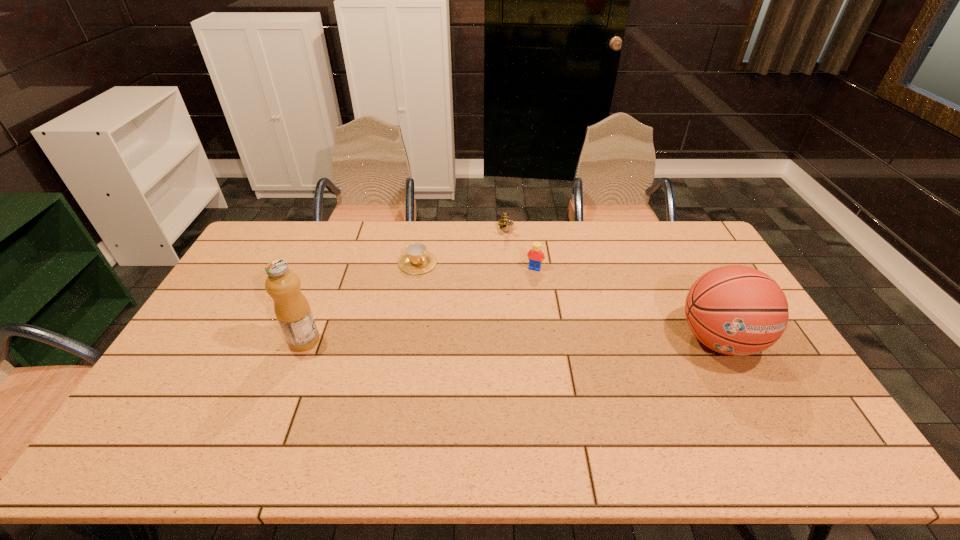
Where is `the leftmost object`? The image size is (960, 540). the leftmost object is located at coordinates (291, 307).

I want to click on the rightmost object, so click(x=736, y=310).

Locate an element on the screen. Image resolution: width=960 pixels, height=540 pixels. the shortest object is located at coordinates (417, 260).

Locate an element on the screen. The image size is (960, 540). the fourth object from right to left is located at coordinates (417, 260).

Identify the location of the fourth object from left to right. This screenshot has width=960, height=540. (535, 256).

Find the location of a particular element. The width and height of the screenshot is (960, 540). the third object from right to left is located at coordinates (505, 221).

Locate an element on the screen. the farthest object is located at coordinates (505, 221).

Where is `free space located on the front label of the leftmost object`? The image size is (960, 540). free space located on the front label of the leftmost object is located at coordinates (221, 340).

Locate an element on the screen. free location located 0.210m on the front label of the leftmost object is located at coordinates (217, 340).

You are a GUI agent. You are given a task and a screenshot of the screen. Output one action in this format:
    pyautogui.click(x=<x>, y=<y>)
    Task: Click on the vacant space located on the front label of the leftmost object
    The width and height of the screenshot is (960, 540).
    Given the screenshot: What is the action you would take?
    pyautogui.click(x=217, y=340)